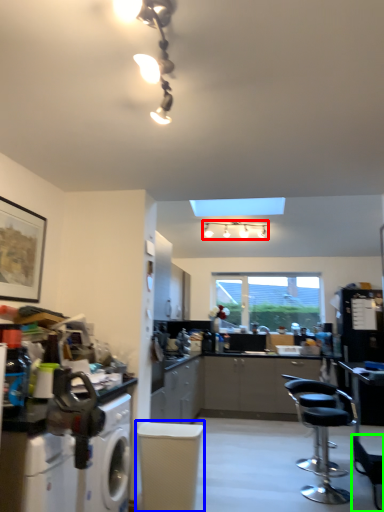
Question: Estimate the real-world distances between objects in this image. Which object is farther from lamp (highlighted by a red box), swivel chair (highlighted by a blue box) or chair (highlighted by a green box)?

Choices:
 (A) swivel chair
 (B) chair

Answer: (A)